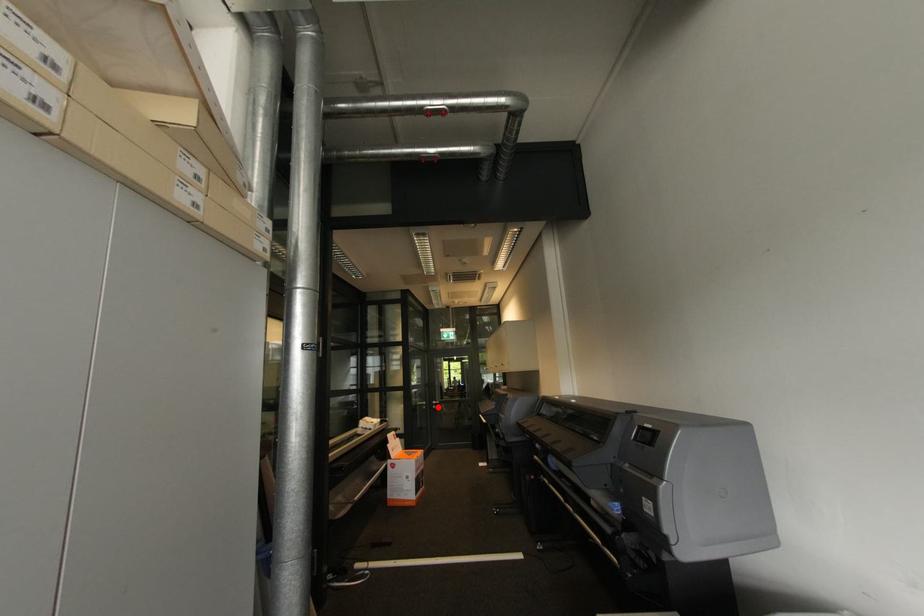
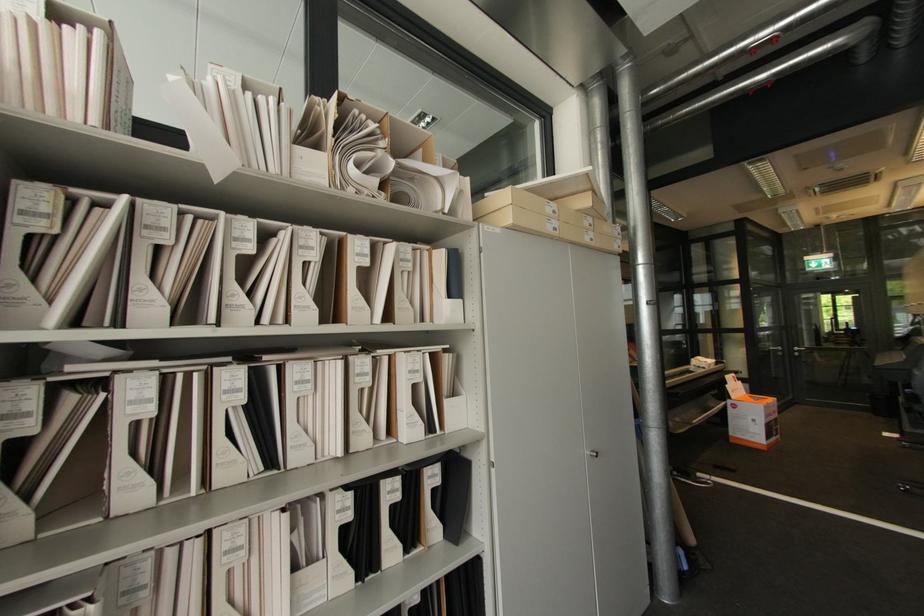
Find the pixel in the second image that matches the highlighted location in the first image.

(800, 354)